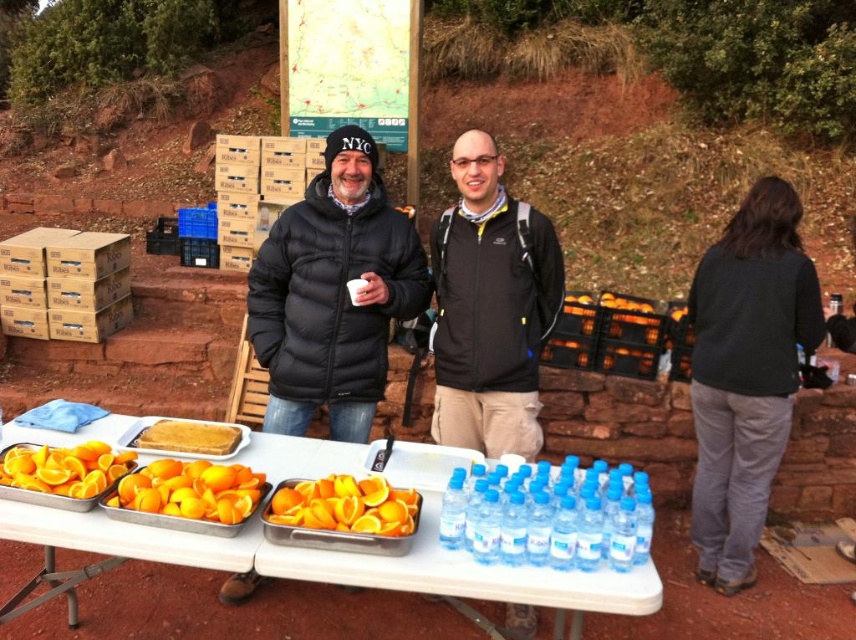
Does white plastic table at center have a greater width compared to dark gray sweater at right?

Yes.

Based on the photo, between white plastic table at center and dark gray sweater at right, which one appears on the left side from the viewer's perspective?

Positioned to the left is white plastic table at center.

Between point (397, 563) and point (773, 412), which one is positioned in front?

Point (397, 563) is in front.

The width and height of the screenshot is (856, 640). Find the location of `white plastic table at center`. white plastic table at center is located at coordinates (384, 536).

Is point (189, 449) closer to camera compared to point (610, 547)?

No, it is not.

Where is `golden crumbly pie at center`? This screenshot has height=640, width=856. golden crumbly pie at center is located at coordinates (188, 436).

This screenshot has width=856, height=640. I want to click on clear plastic water bottle at center, so click(x=453, y=512).

Which is above, clear plastic water bottle at center or clear plastic bottle at center?

clear plastic water bottle at center is above.

At what (x,y) coordinates should I click in order to perform the action: click on clear plastic water bottle at center. Please return your answer as a coordinate pair (x, y). Image resolution: width=856 pixels, height=640 pixels. Looking at the image, I should click on (453, 512).

Image resolution: width=856 pixels, height=640 pixels. What are the coordinates of `clear plastic water bottle at center` in the screenshot? It's located at (453, 512).